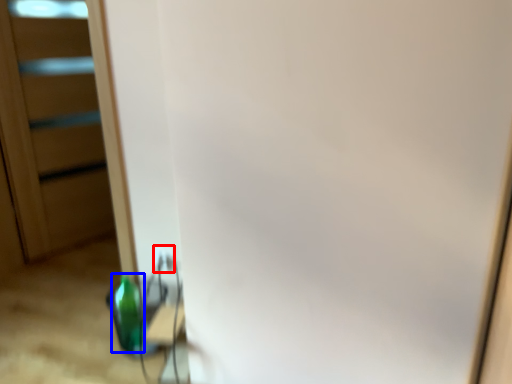
Question: Which of the following is the closest to the observer, electric outlet (highlighted by a red box) or bottle (highlighted by a blue box)?

Choices:
 (A) electric outlet
 (B) bottle

Answer: (B)